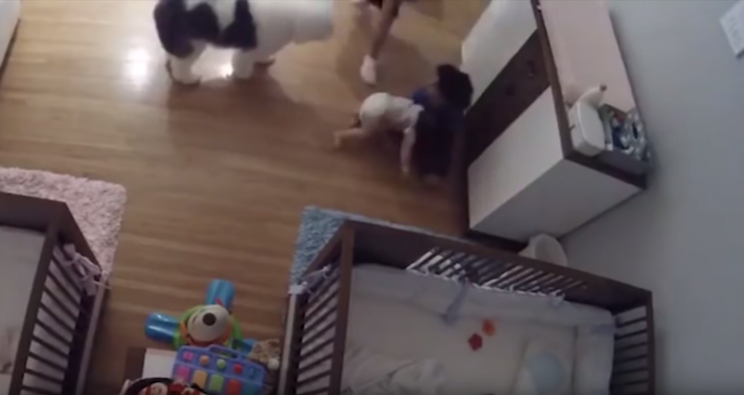
You are a GUI agent. You are given a task and a screenshot of the screen. Output one action in this format:
    pyautogui.click(x=<x>, y=<y>)
    Task: Click on the rugs
    This screenshot has width=744, height=395.
    Given the screenshot: What is the action you would take?
    pyautogui.click(x=97, y=212), pyautogui.click(x=317, y=227)